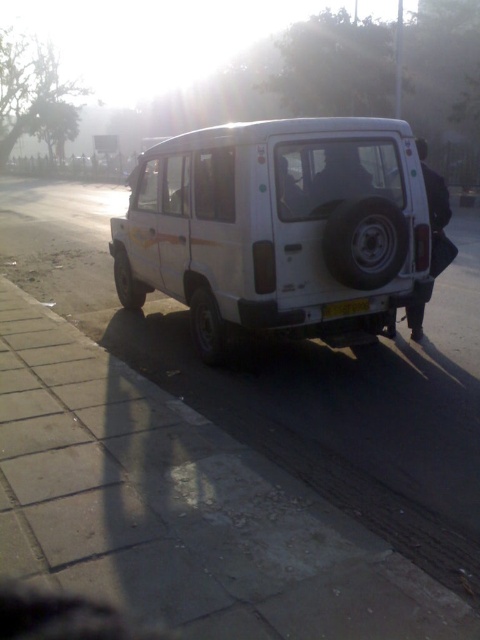
In the scene shown: You are a pedestrian standing on the gray concrete pavement at center. You want to cross the road to reach the white matte van at center. Is the van in front of or behind you?

The gray concrete pavement at center is closer to the viewer than white matte van at center, so the van is behind you.

You are a delivery driver who needs to park your white matte van at center precisely at the coordinates provided. Can you confirm if the van is already positioned correctly at the specified coordinates?

The white matte van at center is located exactly at point (277, 227), so it is correctly positioned.

You are a delivery driver who needs to park your white matte van at center under a low hanging tree branch. The branch is exactly at the height of the yellow plastic license plate at rear. Will the van clear the branch when passing through?

The white matte van at center is much taller than the yellow plastic license plate at rear. Since the branch is at the height of the license plate, the van will hit the branch when passing through.